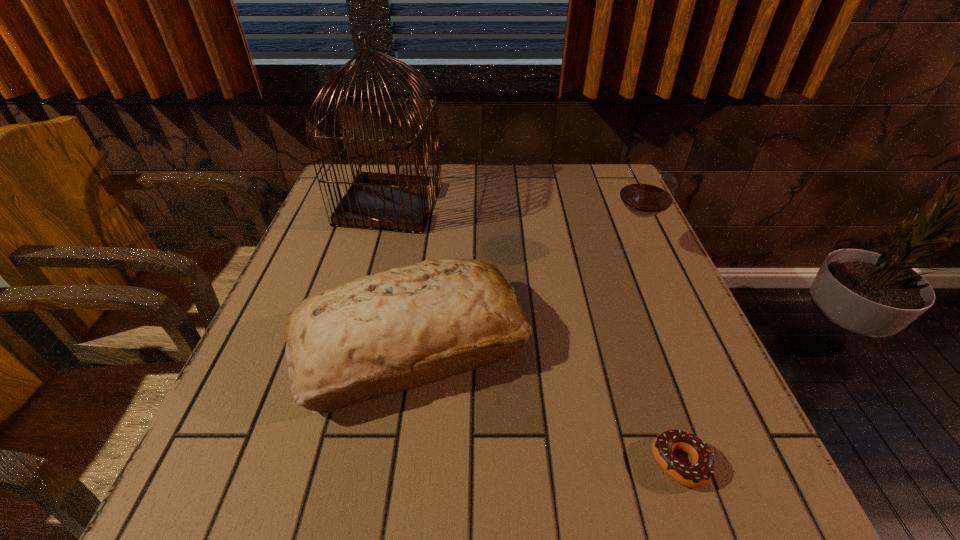
Where is `vacant space that's between the shortest object and the bread`? vacant space that's between the shortest object and the bread is located at coordinates (545, 404).

Find the location of `vacant area that lies between the third shortest object and the nearest object`. vacant area that lies between the third shortest object and the nearest object is located at coordinates (656, 357).

Where is `vacant area that lies between the second tallest object and the tallest object`? The height and width of the screenshot is (540, 960). vacant area that lies between the second tallest object and the tallest object is located at coordinates (510, 228).

The height and width of the screenshot is (540, 960). Identify the location of empty space between the second nearest object and the nearest object. (x=545, y=404).

I want to click on free spot between the wineglass and the nearest object, so click(x=656, y=357).

This screenshot has width=960, height=540. I want to click on object identified as the closest to the wineglass, so click(x=377, y=335).

This screenshot has width=960, height=540. I want to click on object that ranks as the third closest to the birdcage, so click(696, 475).

This screenshot has width=960, height=540. Identify the location of vacant region that satisfies the following two spatial constraints: 1. on the front side of the second shortest object; 2. on the left side of the tallest object. (350, 345).